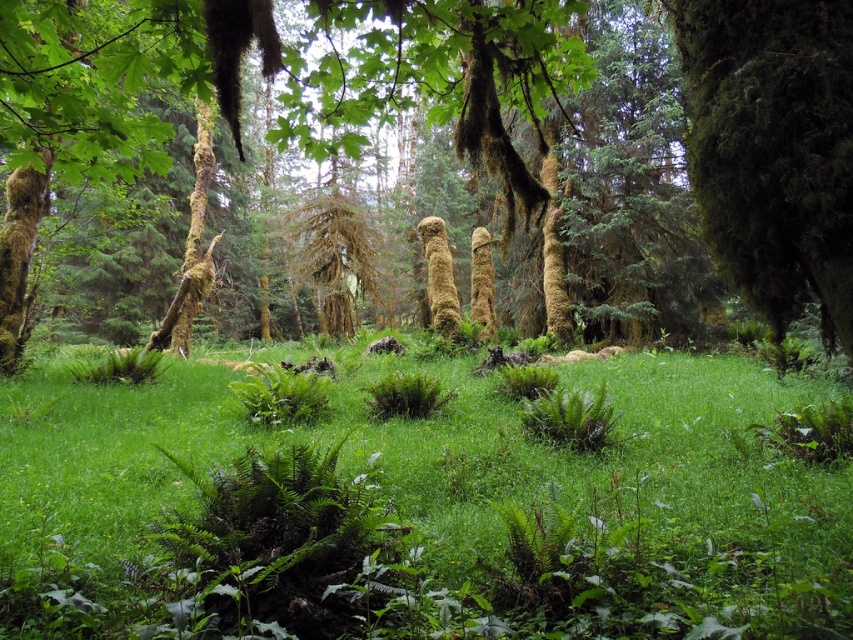
You are a hiker who wants to place a 6 meter long tent between the green grassy at center and the green mossy tree trunk at left. Can you fit the tent in that space?

The distance between the green grassy at center and the green mossy tree trunk at left is 5.81 meters, which is shorter than the 6 meter long tent. Therefore, the tent cannot be placed in that space.

You are a hiker who wants to take a photo of both the green mossy tree at right and the green mossy tree trunk at left. Which direction should you walk to ensure both are in your camera frame?

You should walk to the left so that both the green mossy tree at right and the green mossy tree trunk at left are within your camera frame. Since the green mossy tree at right is to the right of the green mossy tree trunk at left, moving left will allow you to capture both in the frame.